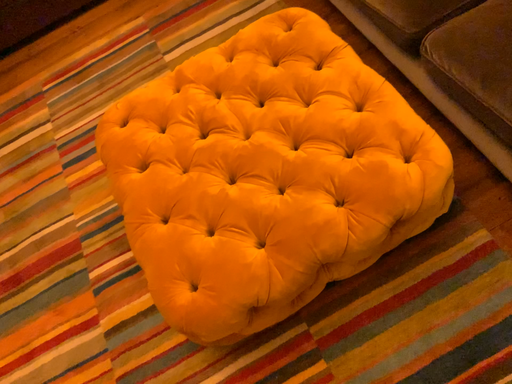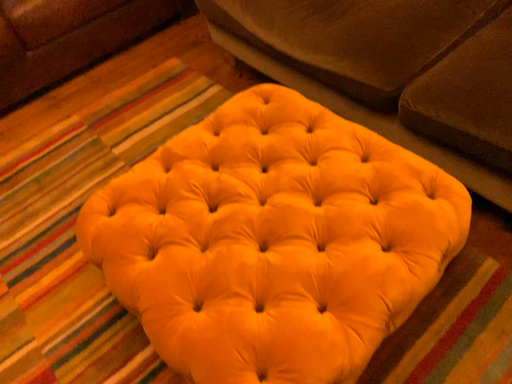
Question: How did the camera likely rotate when shooting the video?

Choices:
 (A) rotated downward
 (B) rotated upward

Answer: (B)